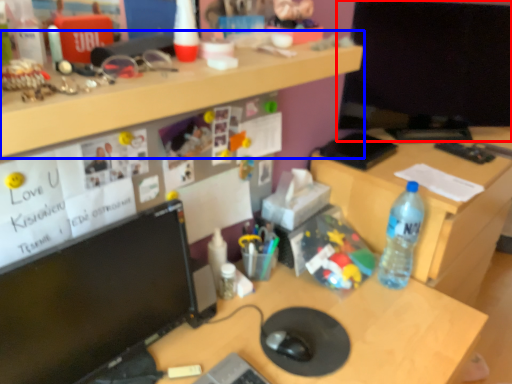
Question: Which point is further to the camera, computer monitor (highlighted by a red box) or desk (highlighted by a blue box)?

Choices:
 (A) computer monitor
 (B) desk

Answer: (A)